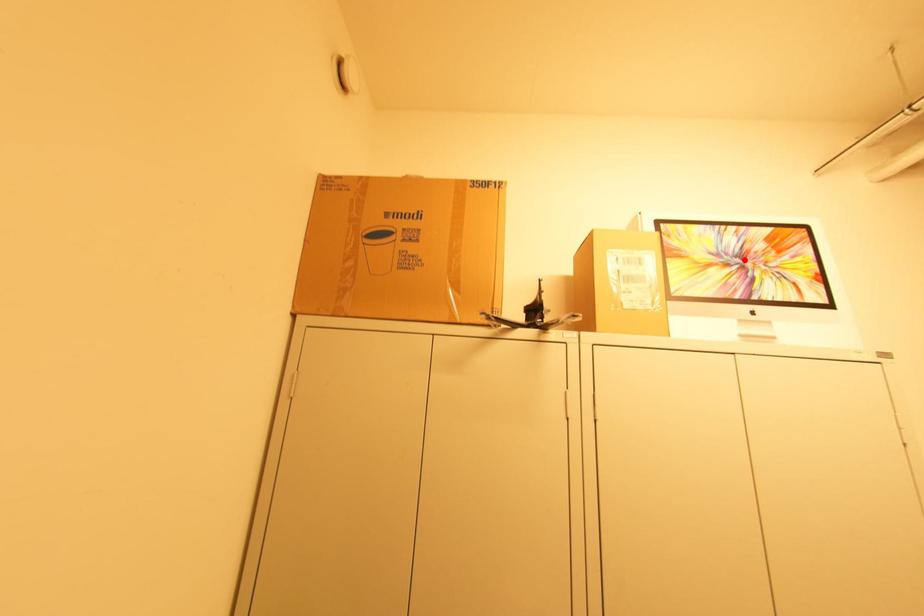
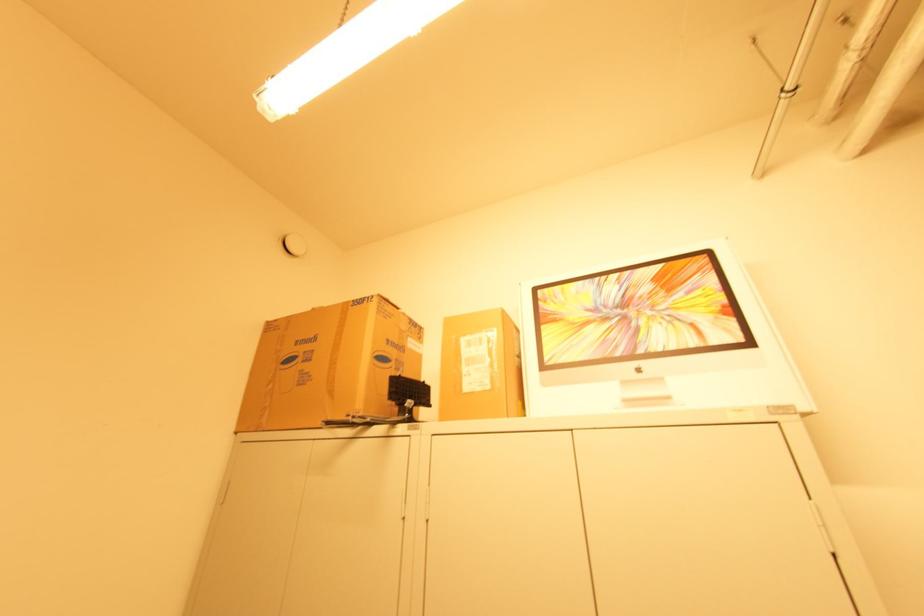
Find the pixel in the second image that matches the highlighted location in the first image.

(625, 310)